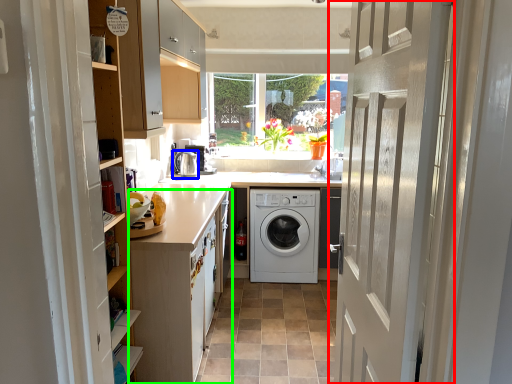
Question: Which is nearer to the door (highlighted by a red box)? water heater (highlighted by a blue box) or cabinetry (highlighted by a green box).

Choices:
 (A) water heater
 (B) cabinetry

Answer: (B)